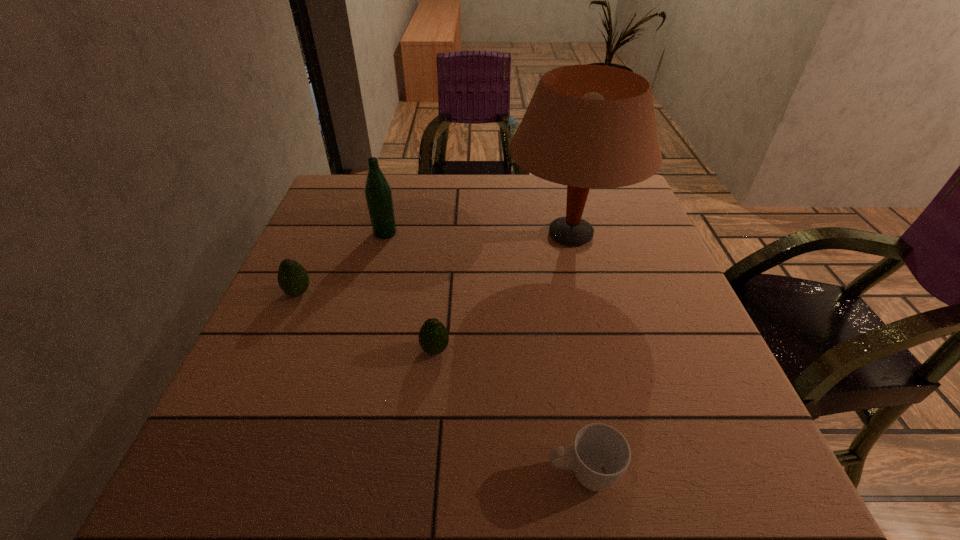
You are a GUI agent. You are given a task and a screenshot of the screen. Output one action in this format:
    pyautogui.click(x=<x>, y=<y>)
    Task: Click on the object that is at the right edge
    The height and width of the screenshot is (540, 960).
    Given the screenshot: What is the action you would take?
    pyautogui.click(x=587, y=126)

This screenshot has height=540, width=960. Identify the location of object at the far right corner. (587, 126).

This screenshot has height=540, width=960. I want to click on free region at the far edge of the desktop, so click(401, 181).

Image resolution: width=960 pixels, height=540 pixels. Identify the location of vacant space at the near edge. (427, 483).

You are a GUI agent. You are given a task and a screenshot of the screen. Output one action in this format:
    pyautogui.click(x=<x>, y=<y>)
    Task: Click on the vacant space at the left edge of the desktop
    The height and width of the screenshot is (540, 960).
    Given the screenshot: What is the action you would take?
    pyautogui.click(x=313, y=258)

The height and width of the screenshot is (540, 960). I want to click on blank space at the right edge, so click(x=626, y=266).

Locate an element on the screen. The image size is (960, 540). vacant space at the far left corner is located at coordinates (343, 216).

Image resolution: width=960 pixels, height=540 pixels. I want to click on vacant point located between the second nearest object and the nearest object, so click(x=509, y=412).

Image resolution: width=960 pixels, height=540 pixels. In order to click on vacant space that's between the lampshade and the left avocado in this screenshot , I will do `click(434, 264)`.

Where is `empty space between the tallest object and the cup`? The width and height of the screenshot is (960, 540). empty space between the tallest object and the cup is located at coordinates (576, 354).